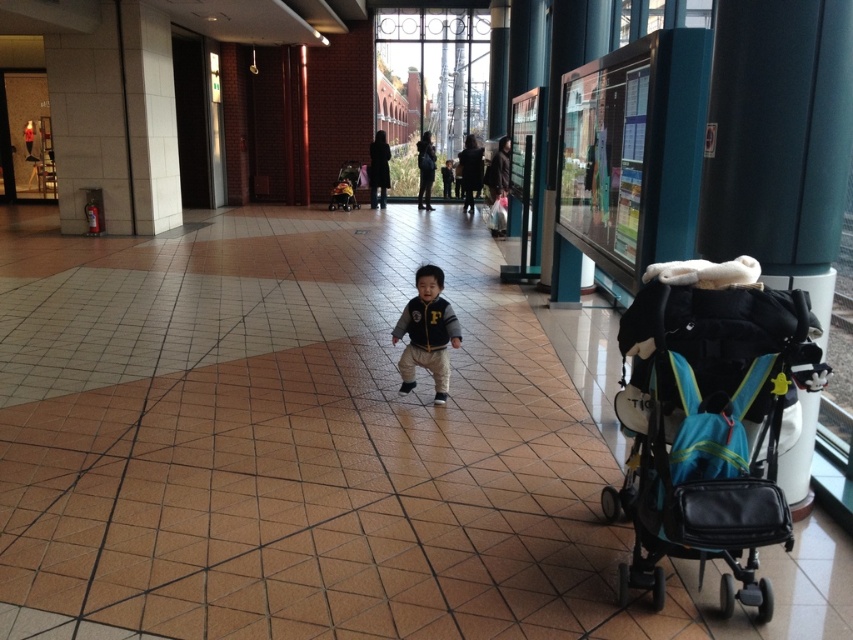
Question: Which point is farther to the camera?

Choices:
 (A) (631, 388)
 (B) (415, 321)

Answer: (B)

Question: Which point is farther to the camera?

Choices:
 (A) matte black jacket at center
 (B) teal fabric stroller at right

Answer: (A)

Question: Does teal fabric stroller at right have a smaller size compared to matte black jacket at center?

Choices:
 (A) no
 (B) yes

Answer: (A)

Question: Considering the relative positions of teal fabric stroller at right and matte black jacket at center in the image provided, where is teal fabric stroller at right located with respect to matte black jacket at center?

Choices:
 (A) left
 (B) right

Answer: (B)

Question: Among these objects, which one is nearest to the camera?

Choices:
 (A) matte black jacket at center
 (B) teal fabric stroller at right

Answer: (B)

Question: In this image, where is teal fabric stroller at right located relative to matte black jacket at center?

Choices:
 (A) left
 (B) right

Answer: (B)